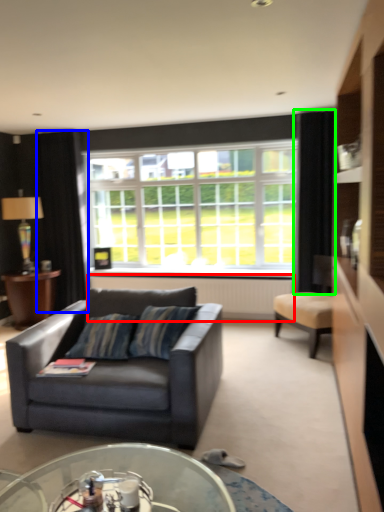
Question: Which object is the farthest from radiator (highlighted by a red box)? Choose among these: curtain (highlighted by a blue box) or curtain (highlighted by a green box).

Choices:
 (A) curtain
 (B) curtain

Answer: (A)